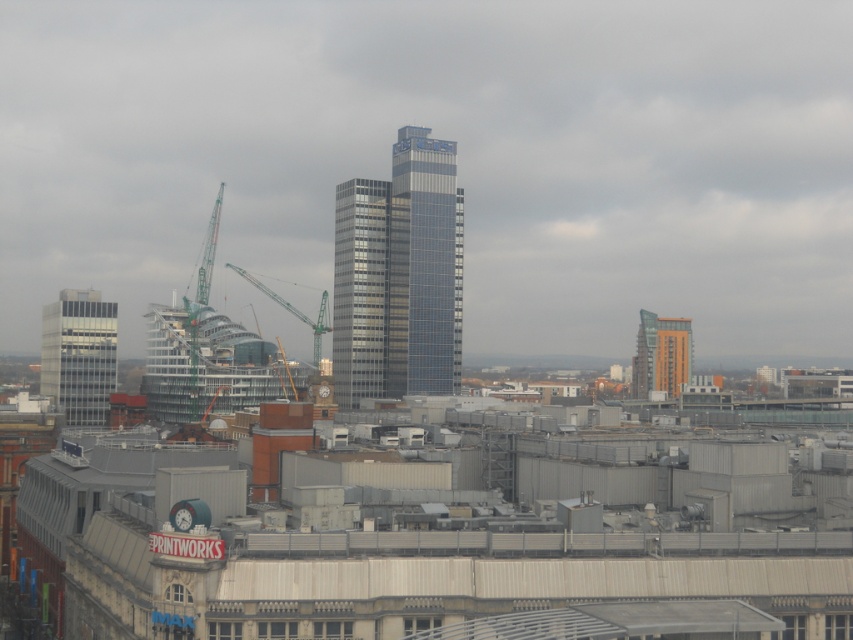
Question: Based on their relative distances, which object is nearer to the glassy metallic skyscraper at center?

Choices:
 (A) green metallic crane at center-left
 (B) matte glass building at left
 (C) orange glass building at right
 (D) glassy steel tower at center

Answer: (D)

Question: Which point is farther to the camera?

Choices:
 (A) (99, 403)
 (B) (281, 298)
 (C) (352, 364)

Answer: (B)

Question: Is matte glass building at left below green metallic crane at center-left?

Choices:
 (A) no
 (B) yes

Answer: (B)

Question: Is matte glass building at left to the left of orange glass building at right from the viewer's perspective?

Choices:
 (A) no
 (B) yes

Answer: (B)

Question: Which object appears closest to the camera in this image?

Choices:
 (A) matte glass building at left
 (B) orange glass building at right
 (C) green metallic crane at center-left
 (D) glassy steel tower at center

Answer: (A)

Question: Is glassy metallic skyscraper at center wider than glassy steel tower at center?

Choices:
 (A) no
 (B) yes

Answer: (B)